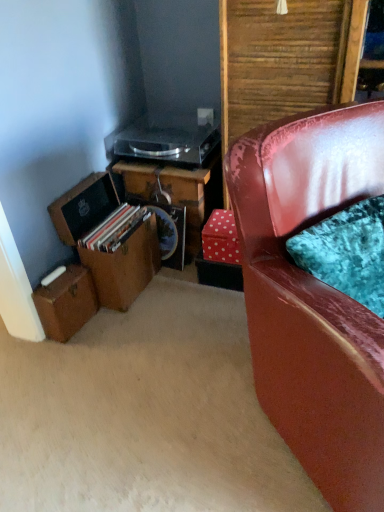
At what (x,y) coordinates should I click in order to perform the action: click on free point above red polka dot cardboard box at lower right (from a real-world perspective). Please return your answer as a coordinate pair (x, y). Image resolution: width=384 pixels, height=512 pixels. Looking at the image, I should click on (223, 219).